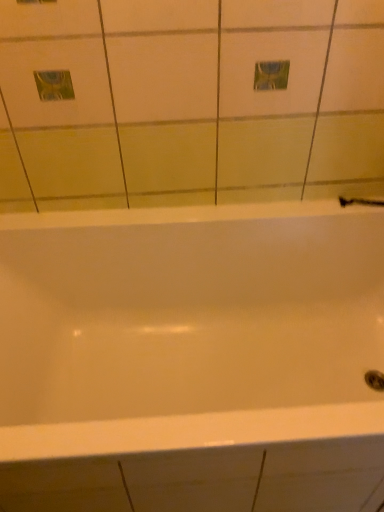
Question: In the image, is white glossy shower at right positioned in front of or behind white glossy bathtub at center?

Choices:
 (A) behind
 (B) front

Answer: (A)

Question: Based on their sizes in the image, would you say white glossy shower at right is bigger or smaller than white glossy bathtub at center?

Choices:
 (A) small
 (B) big

Answer: (A)

Question: Is white glossy shower at right taller or shorter than white glossy bathtub at center?

Choices:
 (A) short
 (B) tall

Answer: (A)

Question: From their relative heights in the image, would you say white glossy bathtub at center is taller or shorter than white glossy shower at right?

Choices:
 (A) tall
 (B) short

Answer: (A)

Question: From a real-world perspective, is white glossy bathtub at center positioned above or below white glossy shower at right?

Choices:
 (A) above
 (B) below

Answer: (B)

Question: From the image's perspective, is white glossy bathtub at center above or below white glossy shower at right?

Choices:
 (A) below
 (B) above

Answer: (A)

Question: Looking at the image, does white glossy bathtub at center seem bigger or smaller compared to white glossy shower at right?

Choices:
 (A) small
 (B) big

Answer: (B)